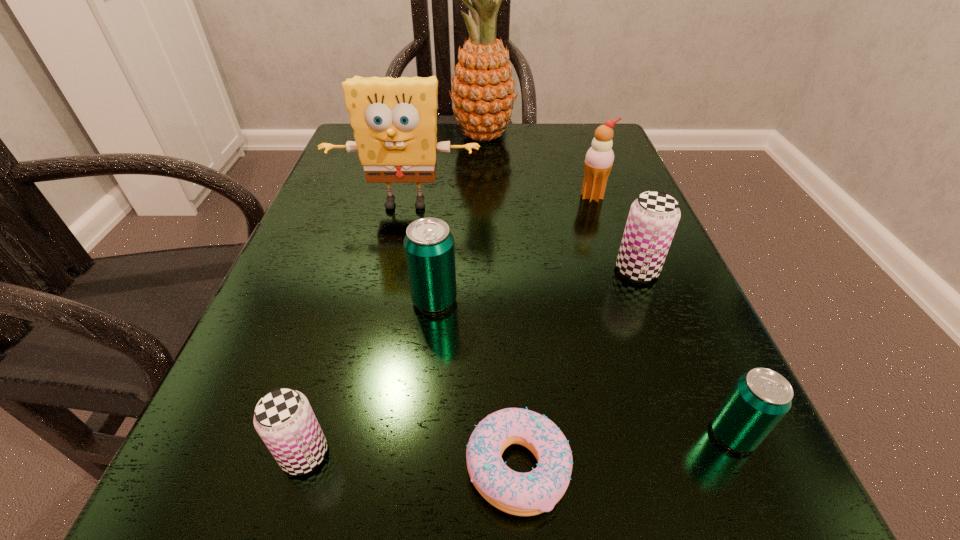
Locate an element on the screen. The height and width of the screenshot is (540, 960). free region that satisfies the following two spatial constraints: 1. on the back side of the farther purple beer can; 2. on the right side of the left teal beer can is located at coordinates (438, 270).